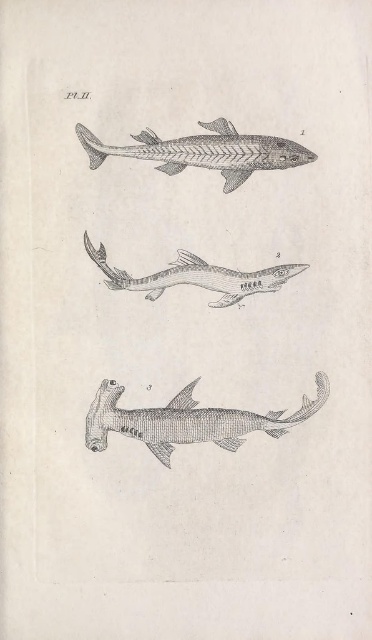
Does gray textured hammerhead shark at bottom appear over gray textured shark at center?

Actually, gray textured hammerhead shark at bottom is below gray textured shark at center.

Does gray textured hammerhead shark at bottom have a lesser width compared to gray textured shark at center?

In fact, gray textured hammerhead shark at bottom might be wider than gray textured shark at center.

Based on the photo, who is more forward, (180, 413) or (281, 276)?

Positioned in front is point (180, 413).

This screenshot has height=640, width=372. In order to click on gray textured hammerhead shark at bottom in this screenshot , I will do point(187,420).

Is point (142, 428) farther from camera compared to point (191, 160)?

That is False.

This screenshot has width=372, height=640. I want to click on gray textured hammerhead shark at bottom, so click(x=187, y=420).

Does point (91, 412) come farther from viewer compared to point (212, 134)?

Yes, point (91, 412) is behind point (212, 134).

Where is `gray textured hammerhead shark at bottom`? Image resolution: width=372 pixels, height=640 pixels. gray textured hammerhead shark at bottom is located at coordinates point(187,420).

Is gray textured shark at upper center to the left of gray textured shark at center from the viewer's perspective?

No, gray textured shark at upper center is not to the left of gray textured shark at center.

Is point (133, 156) less distant than point (88, 244)?

Yes, point (133, 156) is in front of point (88, 244).

What do you see at coordinates (204, 150) in the screenshot? I see `gray textured shark at upper center` at bounding box center [204, 150].

At what (x,y) coordinates should I click in order to perform the action: click on gray textured shark at upper center. Please return your answer as a coordinate pair (x, y). Looking at the image, I should click on coord(204,150).